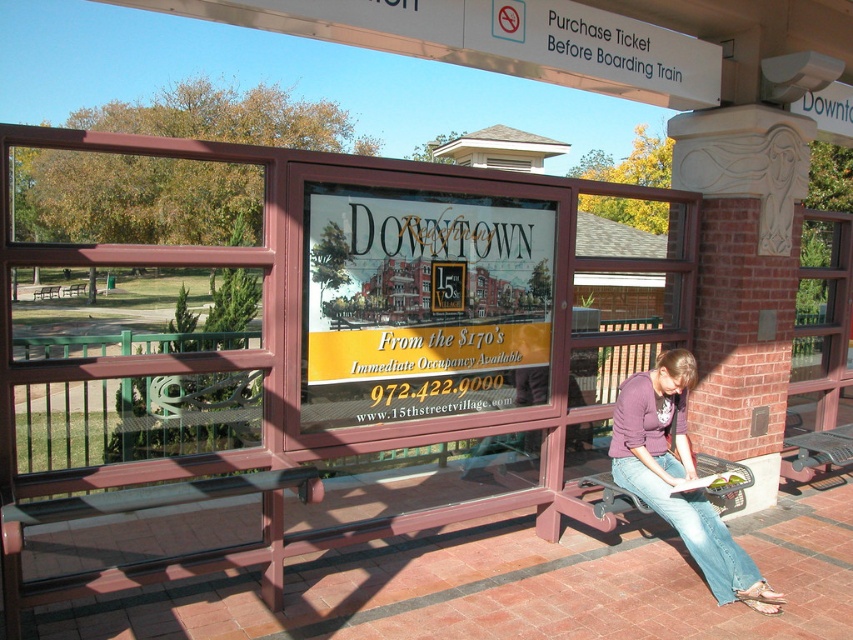
Based on the photo, you are a passenger waiting at the bus stop. You notice the purple soft sweater at lower right and the metallic gray bench at lower right. Which object is closer to the left side of the shelter?

The purple soft sweater at lower right is closer to the left side of the shelter because it is positioned to the left of the metallic gray bench at lower right.

You are a tailor measuring fabrics to create a new seat cover for the metallic gray bench at lower right. You have a piece of fabric that matches the purple soft sweater at lower right in color. Will the fabric width be sufficient to cover the bench?

The purple soft sweater at lower right has a width less than the metallic gray bench at lower right. Therefore, the fabric width matching the sweater will not be sufficient to cover the bench.

You are a photographer standing at the bus stop. You want to take a photo of the purple soft sweater at lower right and the metallic gray bench at lower right. Which object will appear bigger in the photo?

The purple soft sweater at lower right will appear bigger in the photo because it is larger in size than the metallic gray bench at lower right.